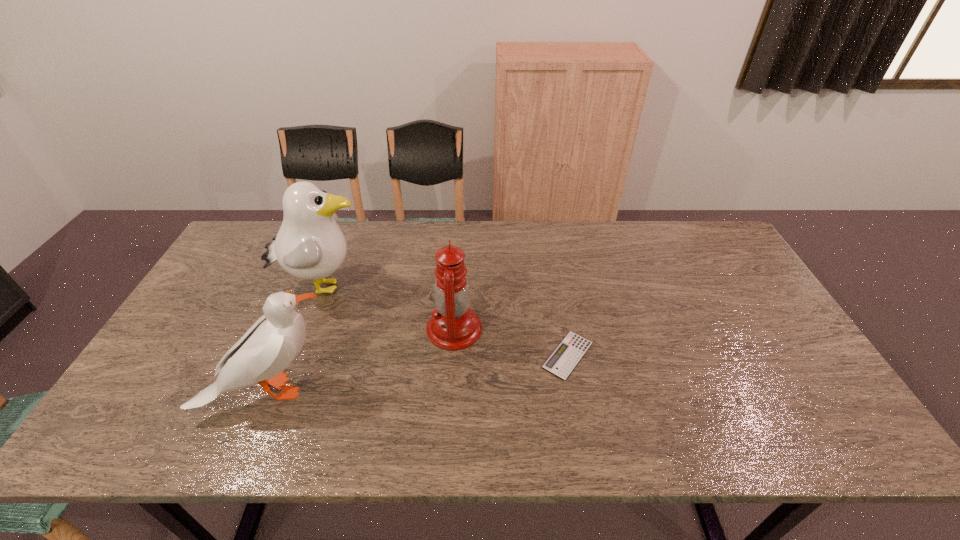
Where is `free space between the shortest object and the shorter gull`? The height and width of the screenshot is (540, 960). free space between the shortest object and the shorter gull is located at coordinates click(419, 373).

At what (x,y) coordinates should I click in order to perform the action: click on free point between the third object from left to right and the taller gull. Please return your answer as a coordinate pair (x, y). The image size is (960, 540). Looking at the image, I should click on (389, 307).

In order to click on vacant space in between the taller gull and the oil lamp in this screenshot , I will do `click(389, 307)`.

Identify the location of object that is the third closest to the second object from right to left. click(270, 345).

At what (x,y) coordinates should I click in order to perform the action: click on object that is the third closest one to the farther gull. Please return your answer as a coordinate pair (x, y). Looking at the image, I should click on (566, 356).

Where is `blank area in the image that satisfies the following two spatial constraints: 1. on the beak of the farther gull; 2. on the right side of the second object from right to left`? blank area in the image that satisfies the following two spatial constraints: 1. on the beak of the farther gull; 2. on the right side of the second object from right to left is located at coordinates (306, 329).

Identify the location of free location that satisfies the following two spatial constraints: 1. on the front side of the second object from right to left; 2. at the beak of the shorter gull. This screenshot has height=540, width=960. pos(450,390).

Image resolution: width=960 pixels, height=540 pixels. What are the coordinates of `free spot that satisfies the following two spatial constraints: 1. on the beak of the second object from right to left; 2. on the left side of the farther gull` in the screenshot? It's located at (306, 329).

The height and width of the screenshot is (540, 960). In order to click on blank area in the image that satisfies the following two spatial constraints: 1. on the front side of the calculator; 2. at the beak of the nearer gull in this screenshot , I will do tap(574, 390).

You are a GUI agent. You are given a task and a screenshot of the screen. Output one action in this format:
    pyautogui.click(x=<x>, y=<y>)
    Task: Click on the free point that satisfies the following two spatial constraints: 1. on the beak of the rightmost object; 2. on the left side of the farther gull
    
    Given the screenshot: What is the action you would take?
    [297, 355]